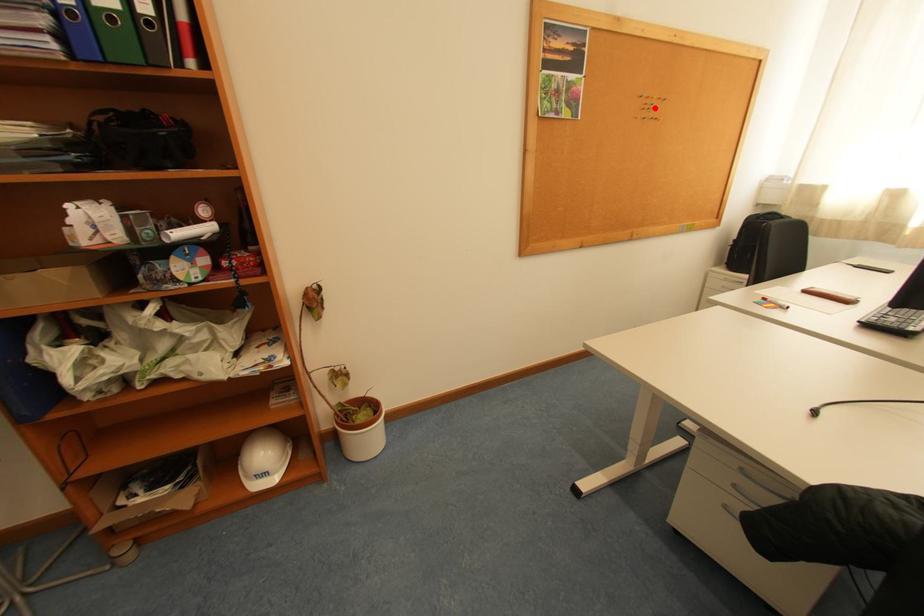
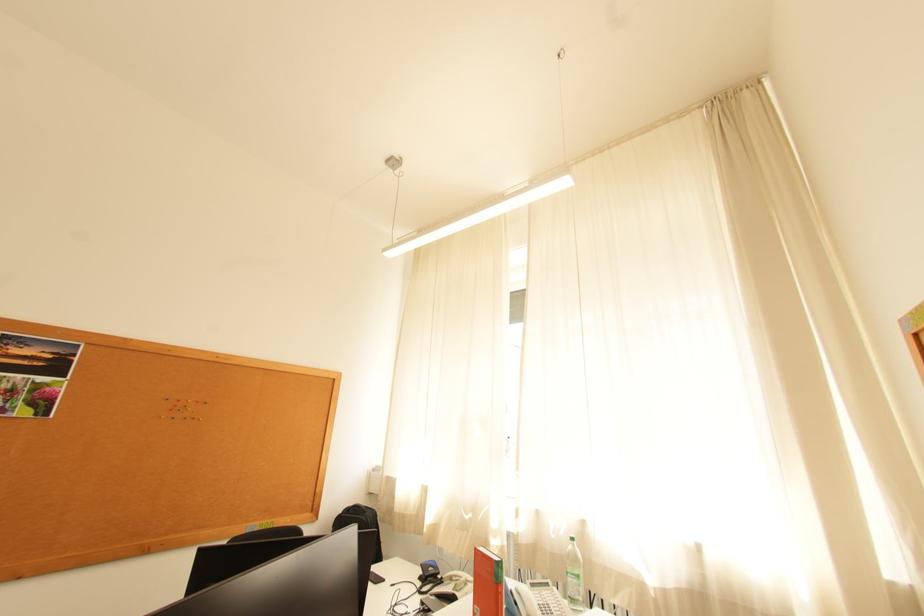
Locate, in the second image, the point that corresponds to the highlighted location in the first image.

(186, 408)